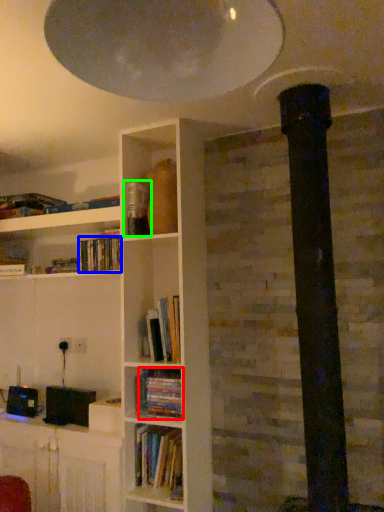
Question: Based on their relative distances, which object is farther from book (highlighted by a red box)? Choose from book (highlighted by a blue box) and paperback book (highlighted by a green box).

Choices:
 (A) book
 (B) paperback book

Answer: (B)